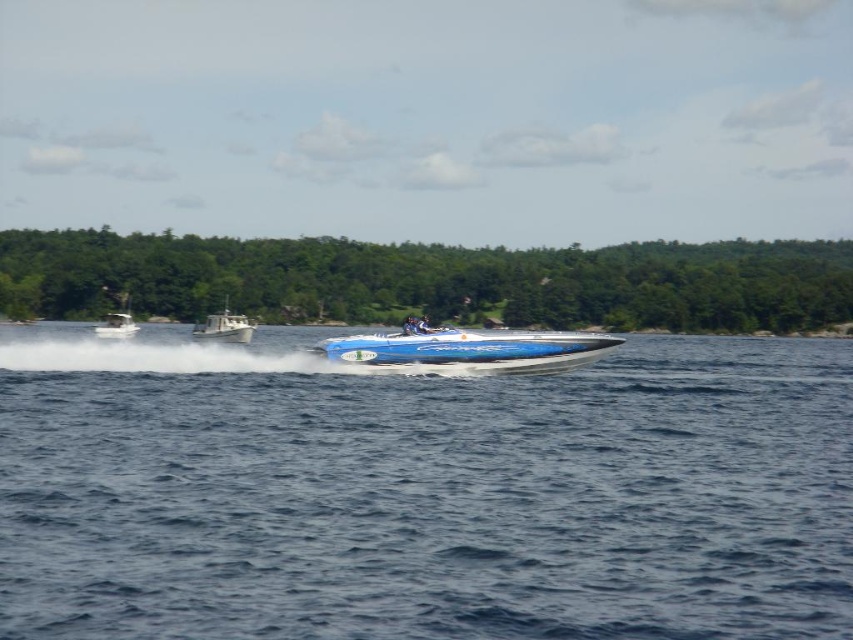
Is blue glossy water at center positioned behind blue metallic speedboat at center?

No, blue glossy water at center is in front of blue metallic speedboat at center.

Looking at this image, can you confirm if blue glossy water at center is smaller than blue metallic speedboat at center?

No, blue glossy water at center is not smaller than blue metallic speedboat at center.

The image size is (853, 640). Describe the element at coordinates (421, 492) in the screenshot. I see `blue glossy water at center` at that location.

Where is `blue glossy water at center`? The height and width of the screenshot is (640, 853). blue glossy water at center is located at coordinates (421, 492).

Consider the image. Can you confirm if blue metallic speedboat at center is positioned above blue glossy speedboat at center?

No.

I want to click on blue metallic speedboat at center, so click(x=468, y=349).

What do you see at coordinates (421, 492) in the screenshot? I see `blue glossy water at center` at bounding box center [421, 492].

Does blue glossy water at center appear on the left side of blue glossy speedboat at center?

Incorrect, blue glossy water at center is not on the left side of blue glossy speedboat at center.

At what (x,y) coordinates should I click in order to perform the action: click on blue glossy water at center. Please return your answer as a coordinate pair (x, y). The height and width of the screenshot is (640, 853). Looking at the image, I should click on [x=421, y=492].

I want to click on blue glossy water at center, so click(x=421, y=492).